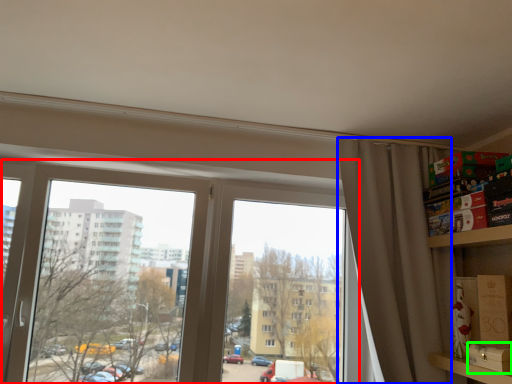
Question: Which object is positioned closest to window (highlighted by a red box)? Select from curtain (highlighted by a blue box) and cardboard box (highlighted by a green box).

Choices:
 (A) curtain
 (B) cardboard box

Answer: (A)